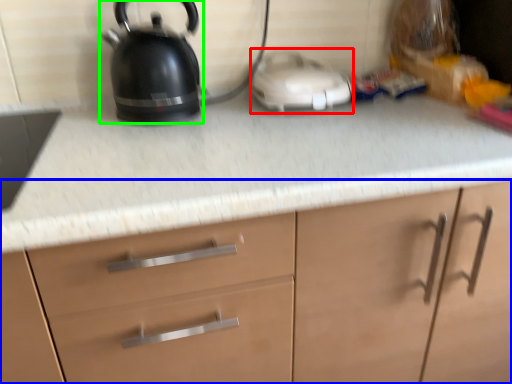
Question: Estimate the real-world distances between objects in this image. Which object is farther from appliance (highlighted by a red box), cabinetry (highlighted by a blue box) or kettle (highlighted by a green box)?

Choices:
 (A) cabinetry
 (B) kettle

Answer: (A)